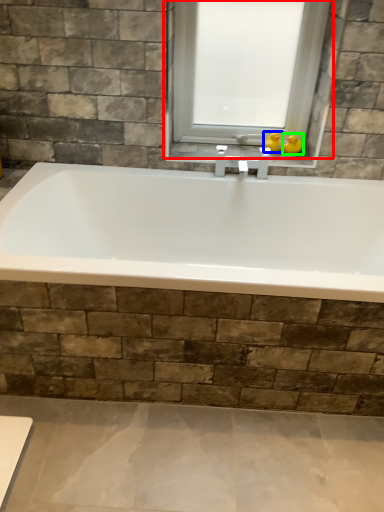
Question: Which is farther away from window (highlighted by a red box)? duck (highlighted by a blue box) or duck (highlighted by a green box)?

Choices:
 (A) duck
 (B) duck

Answer: (B)